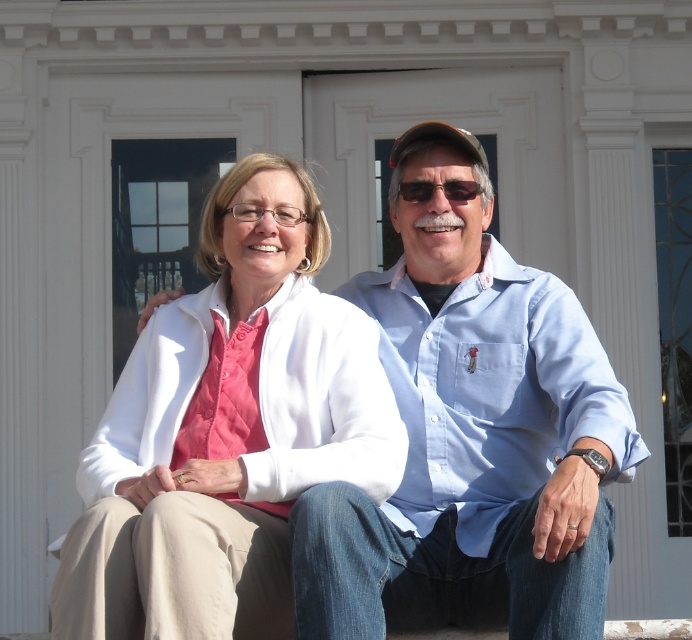
Is blue cotton shirt at center smaller than white matte jacket at center?

Incorrect, blue cotton shirt at center is not smaller in size than white matte jacket at center.

Which is below, blue cotton shirt at center or white matte jacket at center?

white matte jacket at center

Which is in front, point (547, 481) or point (176, 600)?

Positioned in front is point (176, 600).

Where is `blue cotton shirt at center`? blue cotton shirt at center is located at coordinates (471, 433).